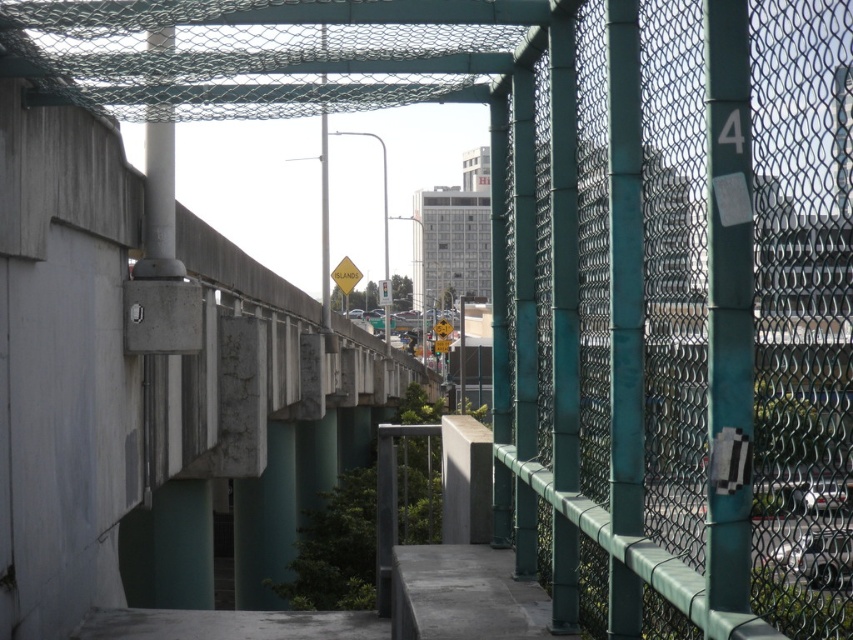
Question: Which object is farther from the camera taking this photo?

Choices:
 (A) teal chain-link fence at center
 (B) yellow reflective plastic at center

Answer: (B)

Question: Can you confirm if teal chain-link fence at center is wider than yellow reflective plastic at center?

Choices:
 (A) no
 (B) yes

Answer: (A)

Question: Can you confirm if teal chain-link fence at center is thinner than yellow reflective plastic at center?

Choices:
 (A) yes
 (B) no

Answer: (A)

Question: Which point is closer to the camera?

Choices:
 (A) yellow reflective plastic at center
 (B) teal chain-link fence at center

Answer: (B)

Question: Where is teal chain-link fence at center located in relation to yellow reflective plastic at center in the image?

Choices:
 (A) below
 (B) above

Answer: (A)